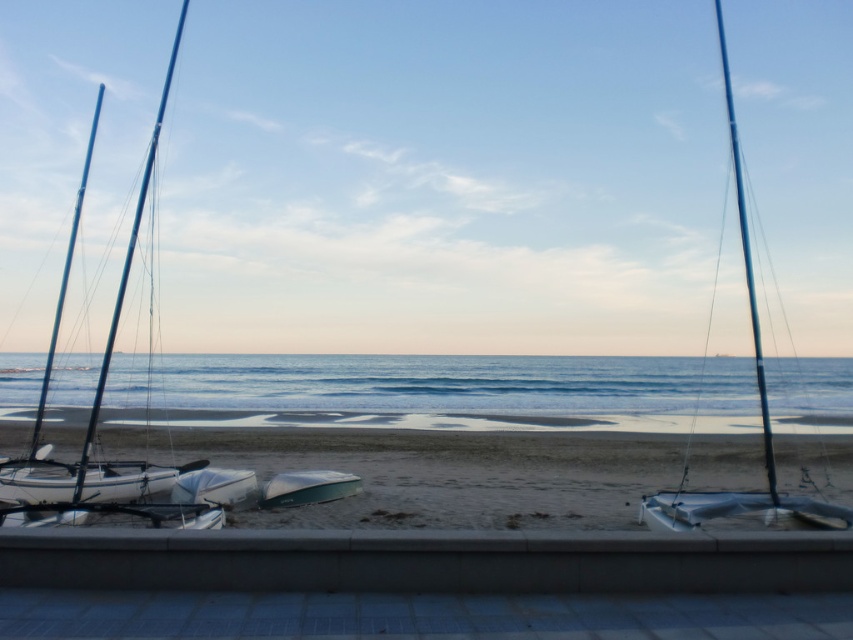
You are standing on the beach and want to walk from point A to point B. Point A is at coordinates point [386,394] and point B is at coordinates point [76,504]. Which point is closer to you when you start walking?

Point A at point [386,394] is closer to you because it is further to the camera than point B at point [76,504], meaning it is physically nearer to your position on the beach.

You are standing at the bottom left corner of the image. If you walk straight towards the center of the image, will you encounter the shiny blue sailboat at right before reaching the ocean?

The shiny blue sailboat at right is located at point (x=759, y=404), which is closer to the bottom edge than the center of the image. Therefore, walking straight towards the center, you would reach the ocean before encountering the shiny blue sailboat at right.

You are a photographer planning to take a photo of both the shiny blue sailboat at right and the green matte boat at center. Since you want both boats to appear equally sized in the photo, which boat should you move closer to, and which should you move farther away?

To make both boats appear the same size in the photo, you should move the green matte boat at center closer to you and move the shiny blue sailboat at right farther away. This is because the shiny blue sailboat at right is wider than the green matte boat at center, so placing it farther away would reduce its apparent size, while bringing the smaller green matte boat at center closer would increase its apparent size until they balance out.